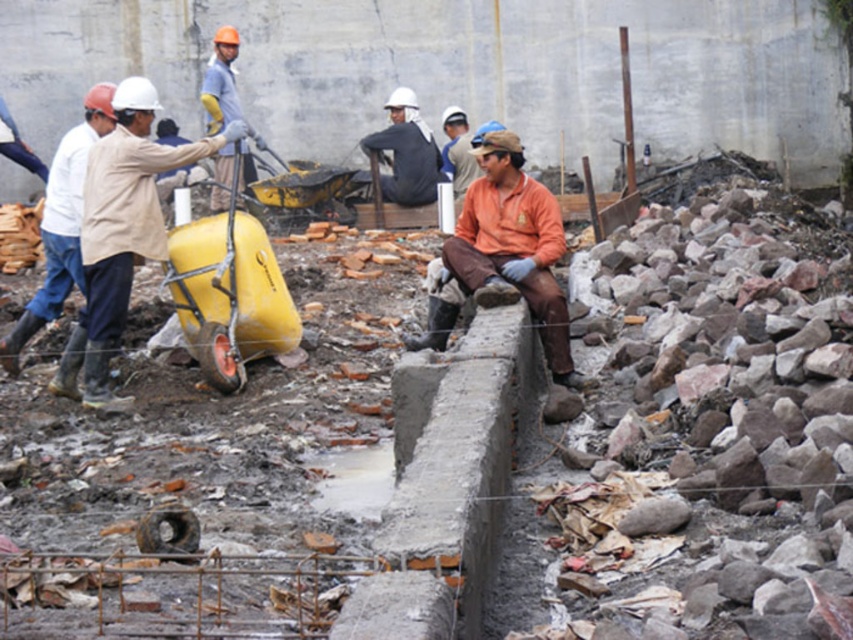
Between matte yellow wheelbarrow at left and orange fabric shirt at center, which one has less height?

Standing shorter between the two is orange fabric shirt at center.

Describe the element at coordinates (120, 232) in the screenshot. I see `matte yellow wheelbarrow at left` at that location.

This screenshot has width=853, height=640. I want to click on matte yellow wheelbarrow at left, so click(120, 232).

Can you confirm if matte yellow wheelbarrow at left is wider than yellow plastic wheelbarrow at left?

Yes.

Looking at this image, who is positioned more to the right, matte yellow wheelbarrow at left or yellow plastic wheelbarrow at left?

Positioned to the right is yellow plastic wheelbarrow at left.

Measure the distance between matte yellow wheelbarrow at left and camera.

matte yellow wheelbarrow at left and camera are 41.99 feet apart from each other.

I want to click on matte yellow wheelbarrow at left, so click(x=120, y=232).

Can you confirm if yellow plastic wheelbarrow at left is shorter than dark gray fabric shirt at center?

Yes, yellow plastic wheelbarrow at left is shorter than dark gray fabric shirt at center.

Is point (219, 362) behind point (436, 147)?

No, (219, 362) is in front of (436, 147).

What are the coordinates of `yellow plastic wheelbarrow at left` in the screenshot? It's located at (229, 289).

Image resolution: width=853 pixels, height=640 pixels. Identify the location of yellow plastic wheelbarrow at left. pos(229,289).